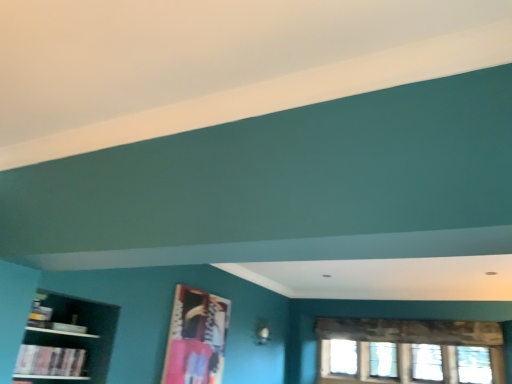
Question: Can you confirm if metallic silver picture frame at center is thinner than clear glass window at lower right?

Choices:
 (A) yes
 (B) no

Answer: (A)

Question: Is metallic silver picture frame at center directly adjacent to clear glass window at lower right?

Choices:
 (A) yes
 (B) no

Answer: (B)

Question: Is metallic silver picture frame at center at the right side of clear glass window at lower right?

Choices:
 (A) yes
 (B) no

Answer: (B)

Question: From the image's perspective, is metallic silver picture frame at center above clear glass window at lower right?

Choices:
 (A) yes
 (B) no

Answer: (A)

Question: Is metallic silver picture frame at center oriented away from clear glass window at lower right?

Choices:
 (A) no
 (B) yes

Answer: (A)

Question: From a real-world perspective, is metallic silver picture frame at center physically below clear glass window at lower right?

Choices:
 (A) no
 (B) yes

Answer: (A)

Question: Is hardcover book at lower left located within dark wood shelf at left?

Choices:
 (A) no
 (B) yes

Answer: (B)

Question: Is dark wood shelf at left positioned in front of hardcover book at lower left?

Choices:
 (A) no
 (B) yes

Answer: (B)

Question: Is dark wood shelf at left to the right of hardcover book at lower left from the viewer's perspective?

Choices:
 (A) no
 (B) yes

Answer: (A)

Question: Is dark wood shelf at left further to the viewer compared to hardcover book at lower left?

Choices:
 (A) yes
 (B) no

Answer: (B)

Question: Can you confirm if dark wood shelf at left is wider than hardcover book at lower left?

Choices:
 (A) no
 (B) yes

Answer: (B)

Question: Is dark wood shelf at left beside hardcover book at lower left?

Choices:
 (A) no
 (B) yes

Answer: (A)

Question: Considering the relative positions of dark wood shelf at left and metallic silver picture frame at center in the image provided, is dark wood shelf at left to the left of metallic silver picture frame at center from the viewer's perspective?

Choices:
 (A) no
 (B) yes

Answer: (B)